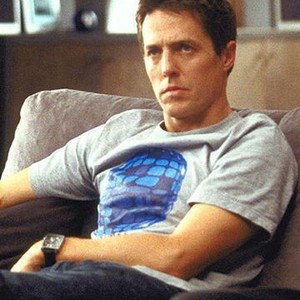
Locate an element on the screen. curtain is located at coordinates (236, 6).